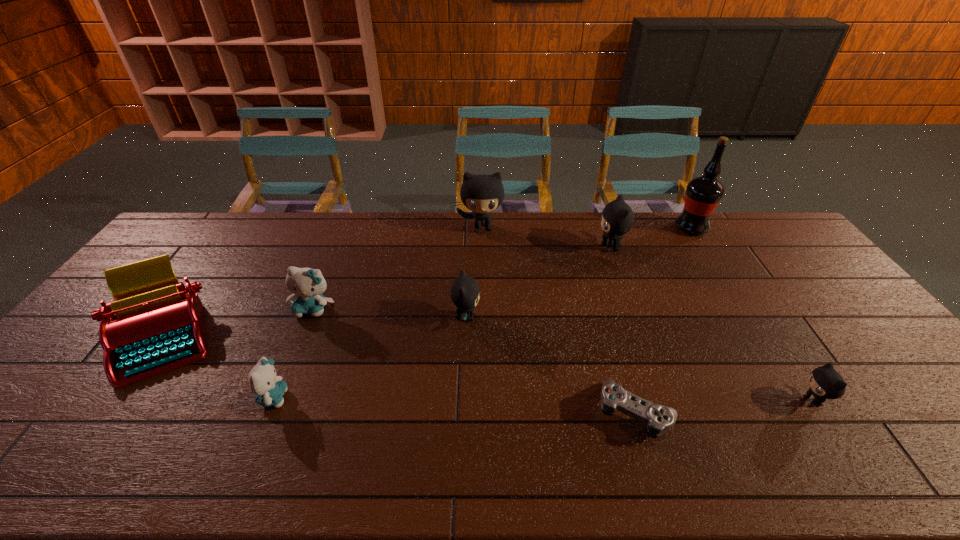
Where is `free spot located 0.060m on the typing side of the leftmost object`? The width and height of the screenshot is (960, 540). free spot located 0.060m on the typing side of the leftmost object is located at coordinates (110, 411).

Identify the location of vacant point located 0.360m on the front-facing side of the third farthest gray kitten. (604, 317).

Where is `blank space located on the face of the smaller blue kitten`? blank space located on the face of the smaller blue kitten is located at coordinates (439, 397).

This screenshot has width=960, height=540. Find the location of `vacant area located on the front-facing side of the rightmost kitten`. vacant area located on the front-facing side of the rightmost kitten is located at coordinates (681, 401).

You are a GUI agent. You are given a task and a screenshot of the screen. Output one action in this format:
    pyautogui.click(x=<x>, y=<y>)
    Task: Click on the free space located 0.320m on the front-facing side of the rightmost kitten
    
    Given the screenshot: What is the action you would take?
    pyautogui.click(x=668, y=401)

The height and width of the screenshot is (540, 960). What are the coordinates of `free location located on the front-facing side of the rightmost kitten` in the screenshot? It's located at (639, 401).

This screenshot has width=960, height=540. Identify the location of blank area located 0.240m on the right of the control. (775, 413).

The height and width of the screenshot is (540, 960). In order to click on wine bottle at the far edge in this screenshot , I will do `click(703, 194)`.

The height and width of the screenshot is (540, 960). Identify the location of object that is at the near edge. (659, 419).

Where is `object that is positioned at the left edge`? object that is positioned at the left edge is located at coordinates (153, 326).